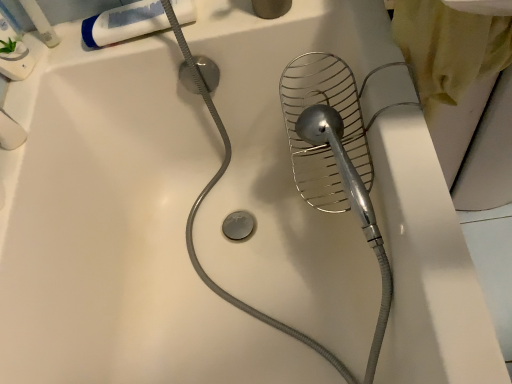
Question: Is point (181, 8) positioned closer to the camera than point (34, 16)?

Choices:
 (A) closer
 (B) farther

Answer: (A)

Question: Which is correct: white matte tube at upper left is inside white plastic tube at upper left, or outside of it?

Choices:
 (A) inside
 (B) outside

Answer: (B)

Question: From a real-world perspective, is white matte tube at upper left above or below white plastic tube at upper left?

Choices:
 (A) above
 (B) below

Answer: (B)

Question: From a real-world perspective, is white plastic tube at upper left positioned above or below white matte tube at upper left?

Choices:
 (A) above
 (B) below

Answer: (A)

Question: Looking at their shapes, would you say white plastic tube at upper left is wider or thinner than white matte tube at upper left?

Choices:
 (A) thin
 (B) wide

Answer: (A)

Question: From the image's perspective, is white plastic tube at upper left above or below white matte tube at upper left?

Choices:
 (A) below
 (B) above

Answer: (B)

Question: Does point (41, 34) appear closer or farther from the camera than point (114, 29)?

Choices:
 (A) closer
 (B) farther

Answer: (B)